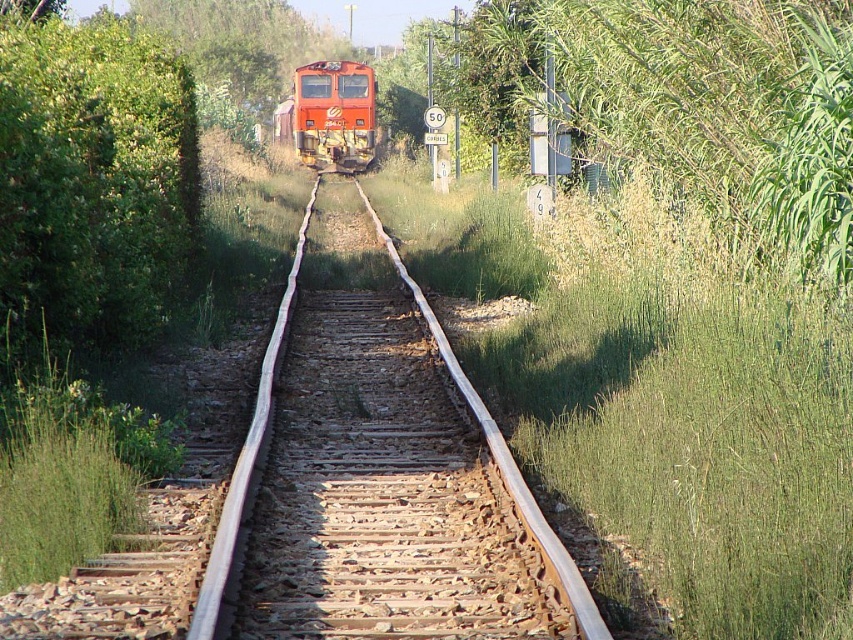
You are a photographer planning to capture a wide shot of the matte orange train at center and the green leafy tree at upper center. Based on the scene, which object occupies more horizontal space in the image?

The green leafy tree at upper center occupies more horizontal space than the matte orange train at center because its width surpasses the train.

You are standing on the railway track and see the green leafy tree at upper center and the matte orange train at center. Which object is positioned to the left when facing the direction the train is heading?

The green leafy tree at upper center is positioned to the left of the matte orange train at center when facing the direction the train is heading.